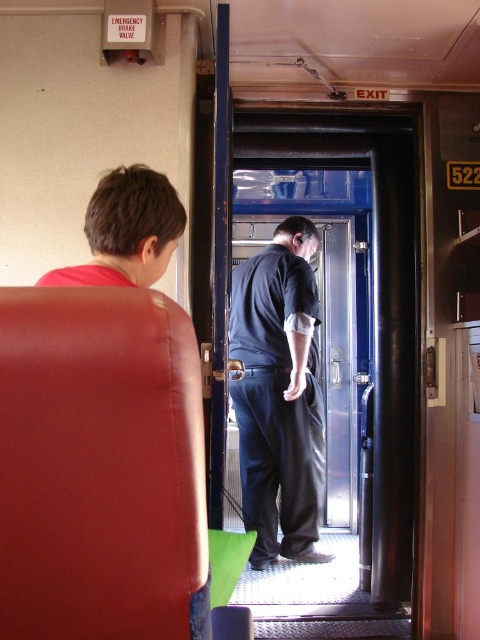
Question: Which is nearer to the dark blue jeans at center?

Choices:
 (A) matte leather seat at left
 (B) red shirt at left

Answer: (B)

Question: Among these points, which one is nearest to the camera?

Choices:
 (A) (252, 340)
 (B) (117, 189)

Answer: (B)

Question: Considering the relative positions of dark blue jeans at center and red shirt at left in the image provided, where is dark blue jeans at center located with respect to red shirt at left?

Choices:
 (A) left
 (B) right

Answer: (B)

Question: Is matte leather seat at left to the left of red shirt at left from the viewer's perspective?

Choices:
 (A) yes
 (B) no

Answer: (B)

Question: Can you confirm if dark blue jeans at center is smaller than red shirt at left?

Choices:
 (A) no
 (B) yes

Answer: (A)

Question: Considering the real-world distances, which object is closest to the red shirt at left?

Choices:
 (A) matte leather seat at left
 (B) dark blue jeans at center

Answer: (A)